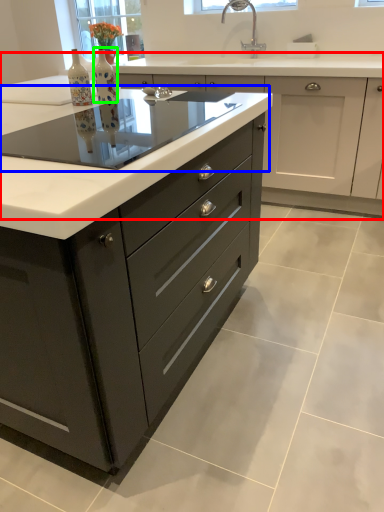
Question: Which object is the closest to the cabinetry (highlighted by a red box)? Choose among these: glass table (highlighted by a blue box) or bottle (highlighted by a green box).

Choices:
 (A) glass table
 (B) bottle

Answer: (A)